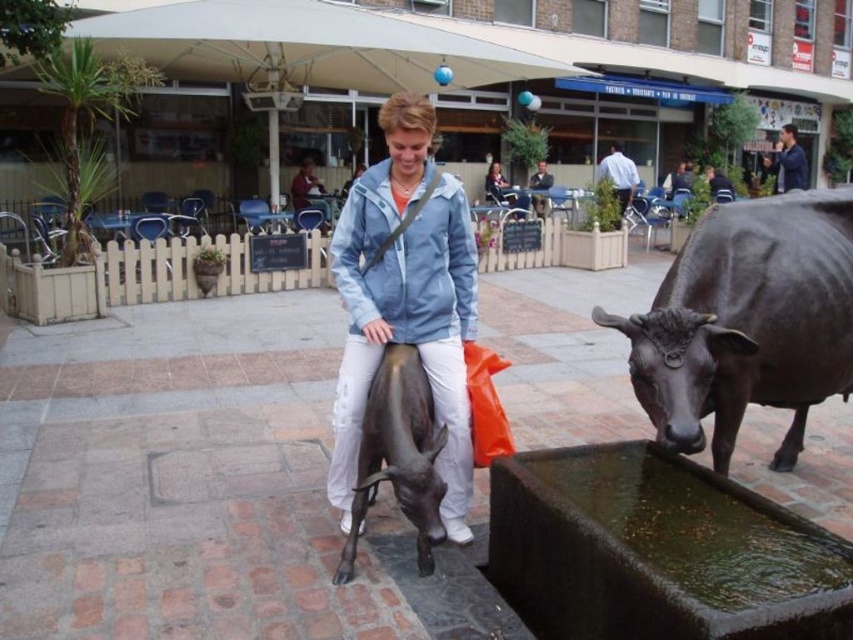
Which of these two, shiny dark brown bull at right or matte blue jacket at center, stands taller?

Standing taller between the two is matte blue jacket at center.

How much distance is there between shiny dark brown bull at right and matte blue jacket at center?

4.23 feet

Is point (775, 220) in front of point (451, 209)?

That is False.

Identify the location of shiny dark brown bull at right. The width and height of the screenshot is (853, 640). (746, 321).

Who is more forward, (x=456, y=528) or (x=376, y=381)?

Point (x=376, y=381)

Can you confirm if matte blue jacket at center is shorter than bronze statue at center?

In fact, matte blue jacket at center may be taller than bronze statue at center.

Locate an element on the screen. The height and width of the screenshot is (640, 853). matte blue jacket at center is located at coordinates (405, 298).

Can you confirm if shiny dark brown bull at right is bigger than bronze statue at center?

Correct, shiny dark brown bull at right is larger in size than bronze statue at center.

Is shiny dark brown bull at right positioned behind bronze statue at center?

That is False.

Who is more forward, [688,320] or [425,532]?

Point [688,320]

I want to click on shiny dark brown bull at right, so click(746, 321).